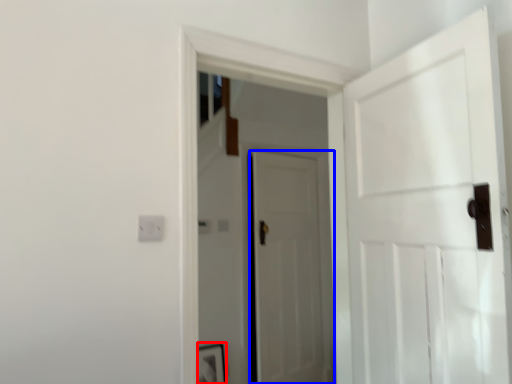
Question: Which object is further to the camera taking this photo, picture frame (highlighted by a red box) or door (highlighted by a blue box)?

Choices:
 (A) picture frame
 (B) door

Answer: (B)